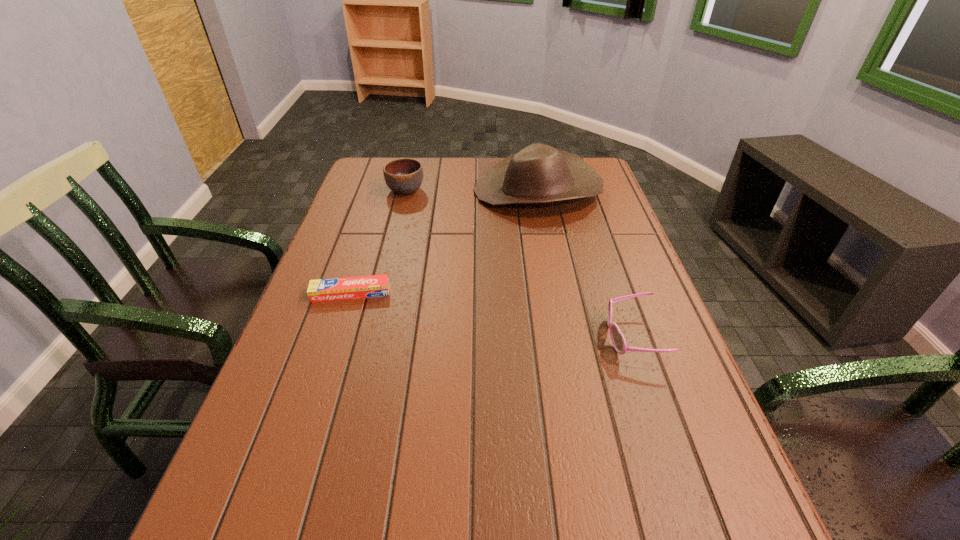
Identify the location of vacant region located 0.160m on the front-facing side of the nearest object. The width and height of the screenshot is (960, 540). (532, 337).

This screenshot has height=540, width=960. I want to click on free region located on the right of the second nearest object, so click(x=427, y=293).

Image resolution: width=960 pixels, height=540 pixels. What are the coordinates of `cowboy hat at the far edge` in the screenshot? It's located at (538, 174).

At what (x,y) coordinates should I click in order to perform the action: click on bowl at the far edge. Please return your answer as a coordinate pair (x, y). Looking at the image, I should click on (403, 176).

Find the location of a particular element. bowl at the left edge is located at coordinates (403, 176).

Where is `toothpaste located in the left edge section of the desktop`? toothpaste located in the left edge section of the desktop is located at coordinates (344, 288).

I want to click on cowboy hat that is at the right edge, so click(538, 174).

In order to click on sunglasses at the right edge in this screenshot , I will do `click(618, 340)`.

Locate an element on the screen. Image resolution: width=960 pixels, height=540 pixels. object located in the far left corner section of the desktop is located at coordinates (403, 176).

The height and width of the screenshot is (540, 960). I want to click on object located in the far right corner section of the desktop, so click(x=538, y=174).